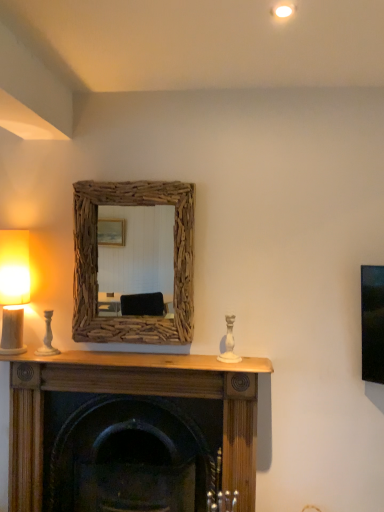
Locate an element on the screen. This screenshot has height=512, width=384. free space underneath driftwood mirror at center (from a real-world perspective) is located at coordinates (134, 353).